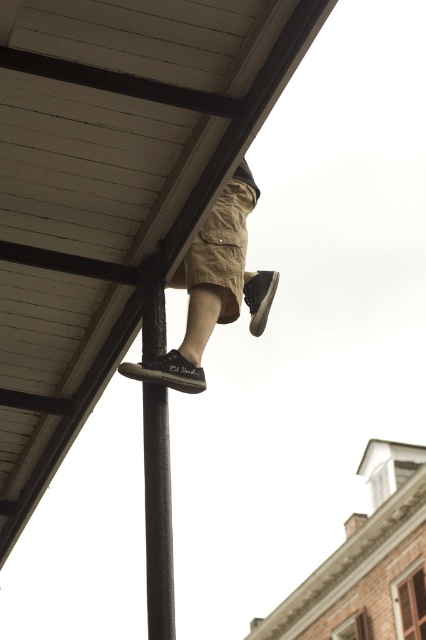
Question: Is black matte pole at center below black canvas shoe at lower center?

Choices:
 (A) yes
 (B) no

Answer: (A)

Question: Which object is farther from the camera taking this photo?

Choices:
 (A) brown suede shoe at lower center
 (B) wooden roof at upper center
 (C) black matte pole at center
 (D) khaki cotton shorts at center

Answer: (A)

Question: Which of the following is the farthest from the observer?

Choices:
 (A) (147, 404)
 (B) (238, 61)
 (C) (169, 385)

Answer: (C)

Question: Does wooden roof at upper center come behind black canvas shoe at lower center?

Choices:
 (A) no
 (B) yes

Answer: (A)

Question: Is the position of black matte pole at center more distant than that of brown suede shoe at lower center?

Choices:
 (A) no
 (B) yes

Answer: (A)

Question: Among these points, which one is farthest from the camera?

Choices:
 (A) (161, 589)
 (B) (143, 61)
 (C) (271, 285)

Answer: (C)